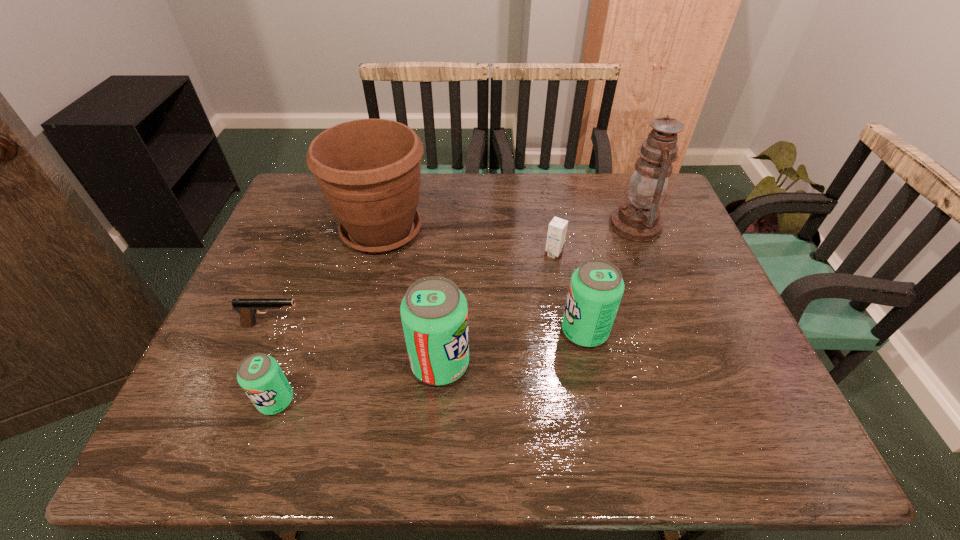
What are the coordinates of `vacant region between the flowerpot and the tallest object` in the screenshot? It's located at (509, 228).

Locate an element on the screen. vacant space that's between the second pop soda from right to left and the pistol is located at coordinates (356, 344).

Identify the location of free space between the flowerpot and the fourth tallest object. The image size is (960, 540). (483, 281).

Where is `vacant space that's between the second pop soda from left to right and the oil lamp`? vacant space that's between the second pop soda from left to right and the oil lamp is located at coordinates (538, 294).

Identify the location of free spot between the oil lamp and the shortest object. (454, 274).

I want to click on object that is the fifth closest to the tallest object, so click(x=247, y=308).

Locate an element on the screen. Image resolution: width=960 pixels, height=540 pixels. object that is the fifth nearest to the flowerpot is located at coordinates (596, 287).

Locate an element on the screen. pop soda that is the closest to the tallest object is located at coordinates (596, 287).

This screenshot has height=540, width=960. I want to click on pop soda that stands as the closest to the pistol, so click(x=260, y=376).

Identify the location of blank area in the image that satisfies the following two spatial constraints: 1. on the back side of the flowerpot; 2. on the right side of the tallest object. (383, 225).